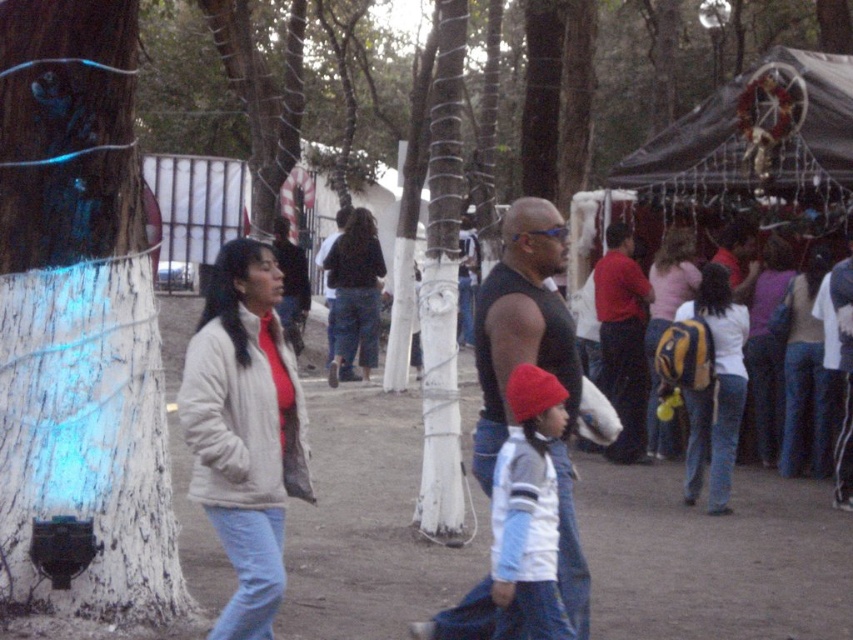
Can you confirm if white fleece jacket at center is taller than yellow and black backpack at center?

No.

Where is `white fleece jacket at center`? white fleece jacket at center is located at coordinates (518, 525).

At what (x,y) coordinates should I click in order to perform the action: click on white fleece jacket at center. Please return your answer as a coordinate pair (x, y). This screenshot has height=640, width=853. Looking at the image, I should click on (518, 525).

Is black tarpaulin canopy at upper right above dark blue jeans at center?

Correct, black tarpaulin canopy at upper right is located above dark blue jeans at center.

Is black tarpaulin canopy at upper right taller than dark blue jeans at center?

Incorrect, black tarpaulin canopy at upper right's height is not larger of dark blue jeans at center's.

Is point (779, 109) less distant than point (367, 296)?

Yes, it is in front of point (367, 296).

The width and height of the screenshot is (853, 640). Identify the location of black tarpaulin canopy at upper right. (755, 134).

Identify the location of yellow backpack at center right. The width and height of the screenshot is (853, 640). (715, 390).

Looking at this image, is yellow backpack at center right to the left of yellow and black backpack at center from the viewer's perspective?

Correct, you'll find yellow backpack at center right to the left of yellow and black backpack at center.

Who is more distant from viewer, (723,372) or (654,422)?

The point (654,422) is behind.

The width and height of the screenshot is (853, 640). What are the coordinates of `yellow backpack at center right` in the screenshot? It's located at (715, 390).